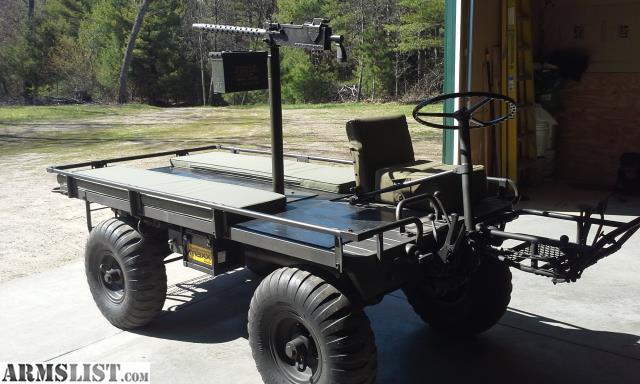
I want to click on 2 long cushions shown, so click(x=233, y=197), click(x=313, y=167).